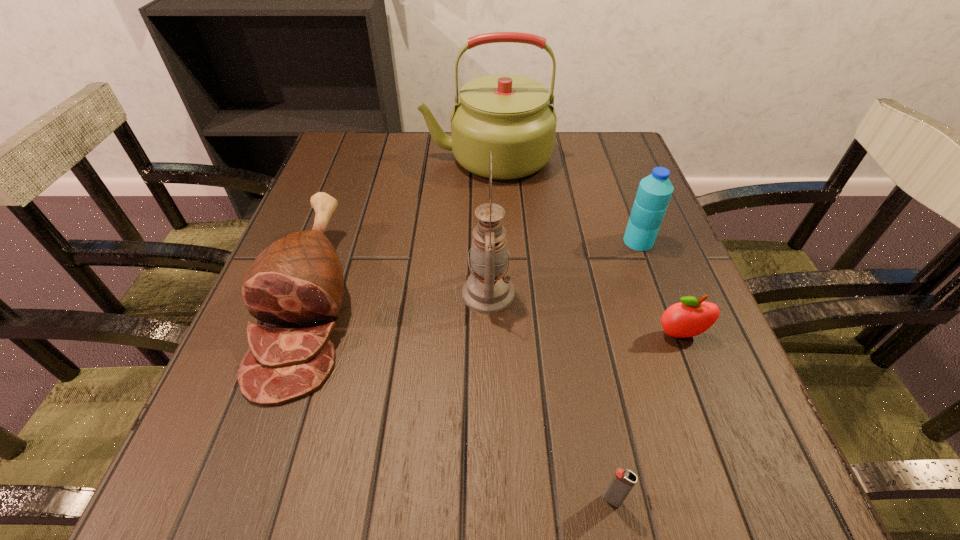
At what (x,y) coordinates should I click in order to perform the action: click on vacant space located at the spout of the farthest object. Please return your answer as a coordinate pair (x, y). Looking at the image, I should click on pos(395,157).

Find the location of a particular element. free space located 0.050m on the left of the oil lamp is located at coordinates (435, 293).

At what (x,y) coordinates should I click in order to perform the action: click on vacant space located 0.100m on the left of the third tallest object. Please return your answer as a coordinate pair (x, y). Looking at the image, I should click on (576, 241).

At what (x,y) coordinates should I click in order to perform the action: click on vacant space located at the sliced end of the leftmost object. Please return your answer as a coordinate pair (x, y). Looking at the image, I should click on (236, 508).

I want to click on free location located on the left of the apple, so click(x=602, y=335).

Locate an element on the screen. The width and height of the screenshot is (960, 540). vacant space located on the back of the nearest object is located at coordinates [x=578, y=322].

Identify the location of object present at the far edge. The height and width of the screenshot is (540, 960). (510, 115).

Where is `object present at the near edge`? This screenshot has height=540, width=960. object present at the near edge is located at coordinates click(x=623, y=481).

Identify the location of object that is positioned at the left edge. (298, 281).

Where is `water bottle at the right edge`? Image resolution: width=960 pixels, height=540 pixels. water bottle at the right edge is located at coordinates pyautogui.click(x=654, y=192).